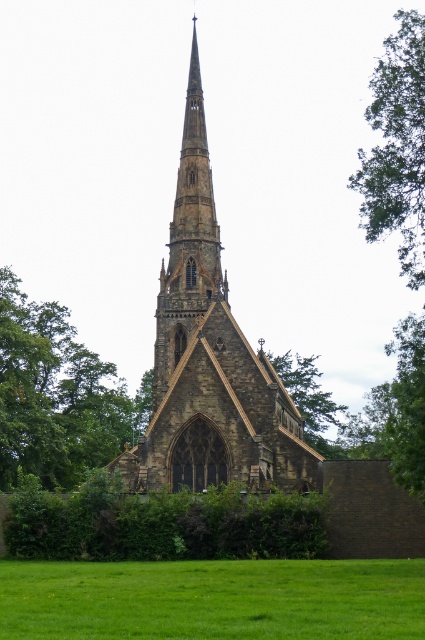
Can you confirm if brown stone church at center is bigger than green grass at lower center?

Yes, brown stone church at center is bigger than green grass at lower center.

Is brown stone church at center above green grass at lower center?

Correct, brown stone church at center is located above green grass at lower center.

Find the location of `brown stone church at center`. brown stone church at center is located at coordinates (209, 358).

Which is more to the right, brown stone church at center or green leafy tree at lower right?

Positioned to the right is green leafy tree at lower right.

Between point (283, 397) and point (268, 353), which one is positioned in front?

Point (283, 397)

Who is more forward, [226,452] or [314,435]?

Point [226,452] is in front.

Where is `brown stone church at center`? The height and width of the screenshot is (640, 425). brown stone church at center is located at coordinates (209, 358).

Is green leafy tree at upper right to the left of green leafy tree at lower right from the viewer's perspective?

Incorrect, green leafy tree at upper right is not on the left side of green leafy tree at lower right.

The width and height of the screenshot is (425, 640). Describe the element at coordinates (397, 147) in the screenshot. I see `green leafy tree at upper right` at that location.

Does point (396, 208) lie behind point (289, 387)?

No, (396, 208) is closer to viewer.

Locate an element on the screen. green leafy tree at upper right is located at coordinates pos(397,147).